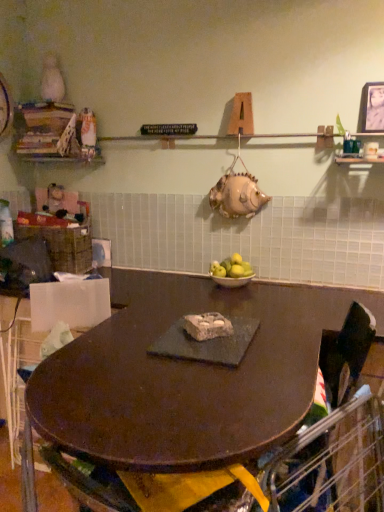
Question: From the image's perspective, is woven brown basket at left on dark brown wood table at center?

Choices:
 (A) no
 (B) yes

Answer: (B)

Question: Is woven brown basket at left positioned before dark brown wood table at center?

Choices:
 (A) yes
 (B) no

Answer: (B)

Question: From the image's perspective, is woven brown basket at left below dark brown wood table at center?

Choices:
 (A) no
 (B) yes

Answer: (A)

Question: From a real-world perspective, is woven brown basket at left on top of dark brown wood table at center?

Choices:
 (A) yes
 (B) no

Answer: (A)

Question: Is woven brown basket at left not inside dark brown wood table at center?

Choices:
 (A) no
 (B) yes

Answer: (B)

Question: Does woven brown basket at left turn towards dark brown wood table at center?

Choices:
 (A) yes
 (B) no

Answer: (B)

Question: Does black fabric swivel chair at center have a greater width compared to woven brown basket at left?

Choices:
 (A) yes
 (B) no

Answer: (A)

Question: Is black fabric swivel chair at center taller than woven brown basket at left?

Choices:
 (A) yes
 (B) no

Answer: (A)

Question: Is black fabric swivel chair at center next to woven brown basket at left?

Choices:
 (A) yes
 (B) no

Answer: (B)

Question: Are black fabric swivel chair at center and woven brown basket at left far apart?

Choices:
 (A) no
 (B) yes

Answer: (B)

Question: Is black fabric swivel chair at center to the right of woven brown basket at left from the viewer's perspective?

Choices:
 (A) no
 (B) yes

Answer: (B)

Question: Does black fabric swivel chair at center have a larger size compared to woven brown basket at left?

Choices:
 (A) no
 (B) yes

Answer: (B)

Question: Is black fabric swivel chair at center positioned with its back to yellow matte apples at center?

Choices:
 (A) no
 (B) yes

Answer: (A)